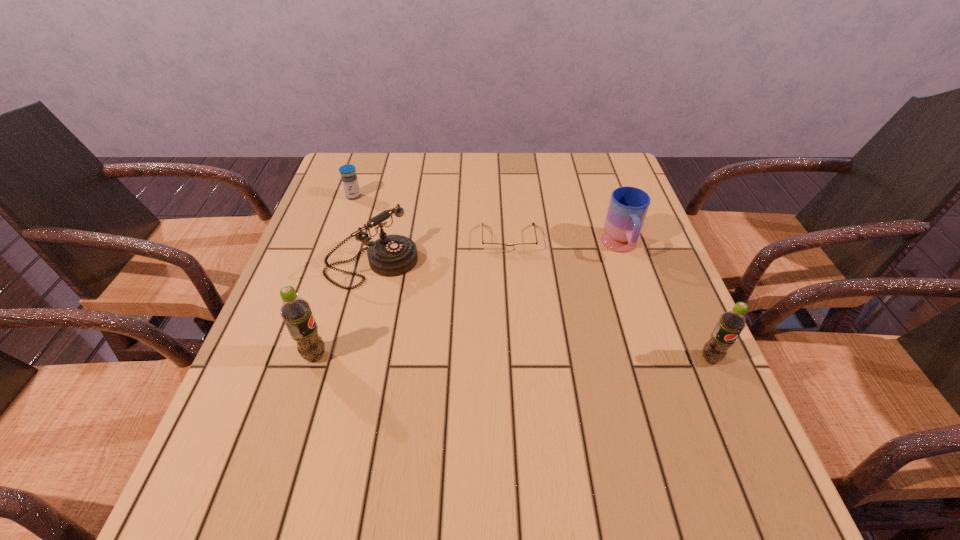
This screenshot has width=960, height=540. In order to click on vacant space located on the front label of the left soda in this screenshot , I will do `click(470, 355)`.

Locate an element on the screen. blank area located on the front label of the right soda is located at coordinates (731, 404).

At what (x,y) coordinates should I click in order to perform the action: click on free space located on the back of the medicine. Please return your answer as a coordinate pair (x, y). Looking at the image, I should click on (363, 168).

The height and width of the screenshot is (540, 960). Identify the location of free region located on the front-facing side of the spectacles. (512, 280).

The height and width of the screenshot is (540, 960). What are the coordinates of `vacant region located 0.140m on the right of the telephone` in the screenshot? It's located at (474, 264).

This screenshot has width=960, height=540. I want to click on vacant space located 0.210m on the side of the mug with the handle, so click(650, 333).

Where is `object located at the far edge`? object located at the far edge is located at coordinates (349, 179).

Locate an element on the screen. soda present at the left edge is located at coordinates (296, 312).

Locate an element on the screen. medicine that is at the left edge is located at coordinates (349, 179).

Identify the location of telephone that is positioned at the left edge. The image size is (960, 540). (393, 255).